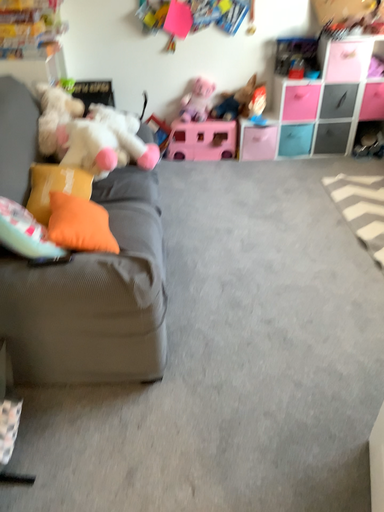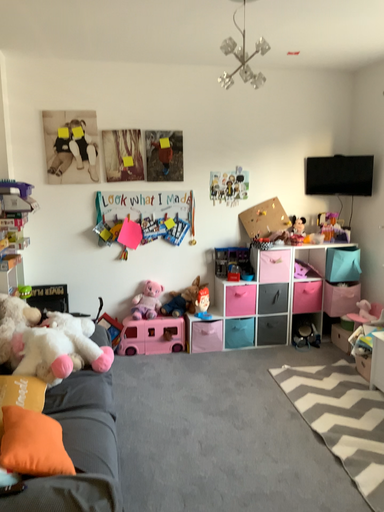
Question: Which way did the camera rotate in the video?

Choices:
 (A) rotated downward
 (B) rotated upward

Answer: (B)